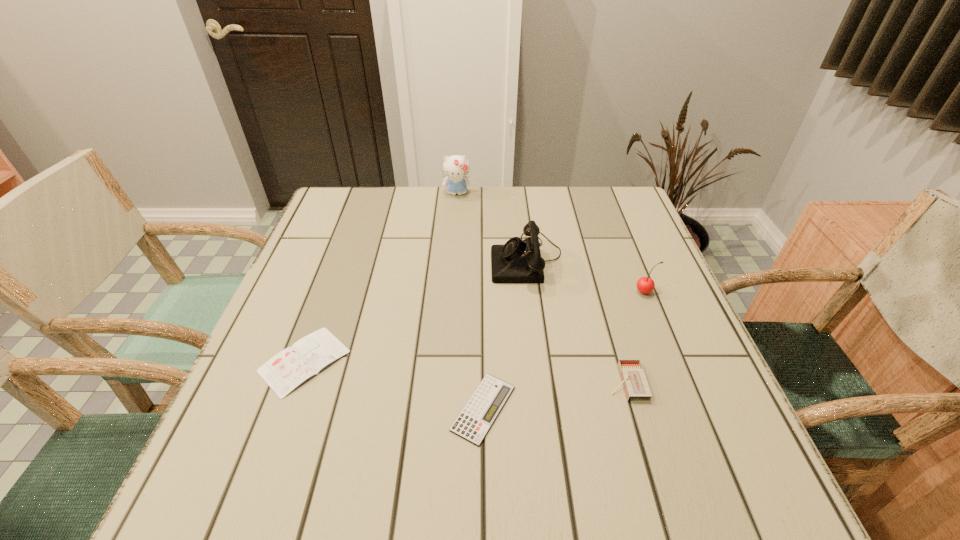
What are the coordinates of `vacant space that is in between the diary and the rightmost object` in the screenshot? It's located at (475, 327).

I want to click on object identified as the third closest to the fifth object from left to right, so click(x=517, y=261).

Select which object appears as the third closest to the fourth tallest object. Please provide its 2D coordinates. Your answer should be formatted as a tuple, i.e. [(x, y)], where the tuple contains the x and y coordinates of a point satisfying the conditions above.

[(517, 261)]

Identify the location of vacant space that satisfies the following two spatial constraints: 1. on the back side of the rightmost object; 2. on the front face of the fifth shortest object. [x=632, y=258].

Locate an element on the screen. vacant region that satisfies the following two spatial constraints: 1. on the front-facing side of the shortest object; 2. on the left side of the kitten is located at coordinates point(442,408).

The height and width of the screenshot is (540, 960). I want to click on vacant space that satisfies the following two spatial constraints: 1. on the front face of the fourth shortest object; 2. on the left side of the telephone, so click(531, 292).